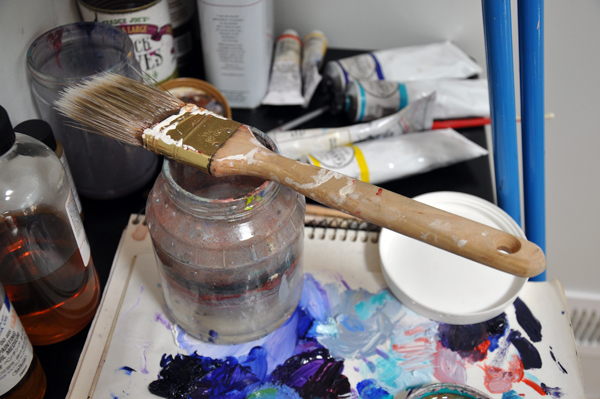
At what (x,y) coordinates should I click in order to perform the action: click on floor air vent. Please return your answer as a coordinate pair (x, y). This screenshot has width=600, height=399. Looking at the image, I should click on pos(583,326).